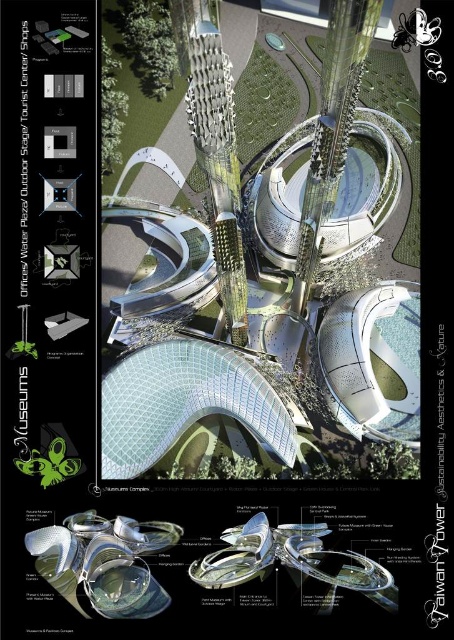
You are an architect reviewing the design of the Taiwan Tower complex. You need to determine the spatial relationship between the sleek silver tower at center and the green matte sculpture at lower left. Which object is closer to the viewer?

The sleek silver tower at center is closer to the viewer than the green matte sculpture at lower left.

You are an architect evaluating the Taiwan Tower design. You notice the sleek silver tower at center and the green matte sculpture at lower left. Which of these two objects has a greater height?

The sleek silver tower at center is much taller than the green matte sculpture at lower left according to the description provided.

In the futuristic Taiwan Tower design, there is a sleek silver tower at center and a green matte sculpture at lower left. From the perspective of an observer looking at the image, which object is positioned to the right of the other?

The sleek silver tower at center is positioned to the right of the green matte sculpture at lower left.